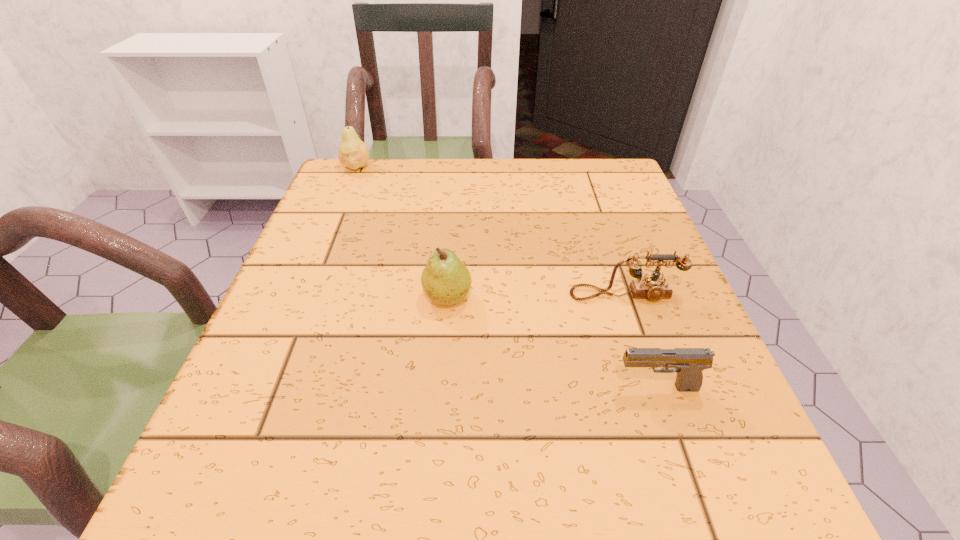
Where is `the farther pear`? the farther pear is located at coordinates coord(352,152).

Where is `the farthest object`? This screenshot has width=960, height=540. the farthest object is located at coordinates (352, 152).

Locate an element on the screen. the nearer pear is located at coordinates (445, 279).

I want to click on the second object from left to right, so (x=445, y=279).

Where is `telephone`? The height and width of the screenshot is (540, 960). telephone is located at coordinates (652, 287).

What are the coordinates of `pistol` in the screenshot? It's located at (688, 363).

The height and width of the screenshot is (540, 960). Identify the location of vacant area situated on the front of the farthest object. (309, 281).

Where is `vacant region located 0.050m on the back of the right pear`? This screenshot has width=960, height=540. vacant region located 0.050m on the back of the right pear is located at coordinates (450, 263).

Identify the location of blank space located on the front-facing side of the telephone. (640, 339).

You are a GUI agent. You are given a task and a screenshot of the screen. Output one action in this format:
    pyautogui.click(x=<x>, y=<y>)
    Task: Click on the blank space located 0.230m aim along the barrel of the nearest object
    This screenshot has width=960, height=540.
    Given the screenshot: What is the action you would take?
    pyautogui.click(x=462, y=388)